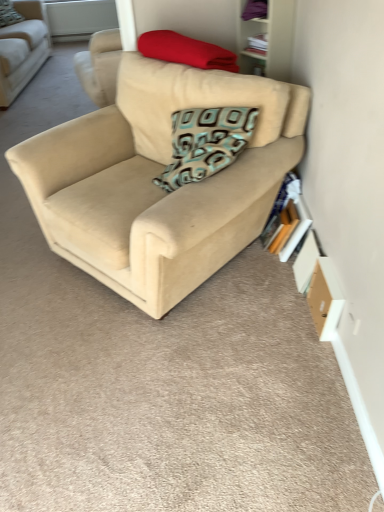
Question: Is teal patterned pillow at upper center, the first pillow from the back, placed right next to matte red blanket at upper center, which is the second pillow from back to front?

Choices:
 (A) yes
 (B) no

Answer: (B)

Question: Could you tell me if teal patterned pillow at upper center, the first pillow from the back, is facing matte red blanket at upper center, which is the second pillow from back to front?

Choices:
 (A) yes
 (B) no

Answer: (A)

Question: Is teal patterned pillow at upper center, the first pillow from the back, shorter than matte red blanket at upper center, marked as the 2th pillow in a top-to-bottom arrangement?

Choices:
 (A) no
 (B) yes

Answer: (A)

Question: Considering the relative positions of teal patterned pillow at upper center, the first pillow when ordered from left to right, and matte red blanket at upper center, which is the 1th pillow in right-to-left order, in the image provided, is teal patterned pillow at upper center, the first pillow when ordered from left to right, to the right of matte red blanket at upper center, which is the 1th pillow in right-to-left order, from the viewer's perspective?

Choices:
 (A) no
 (B) yes

Answer: (A)

Question: Does teal patterned pillow at upper center, positioned as the second pillow in bottom-to-top order, come behind matte red blanket at upper center, the 2th pillow in the left-to-right sequence?

Choices:
 (A) no
 (B) yes

Answer: (B)

Question: Considering the relative positions of teal patterned pillow at upper center, which is counted as the second pillow, starting from the right, and matte red blanket at upper center, which is the second pillow from back to front, in the image provided, is teal patterned pillow at upper center, which is counted as the second pillow, starting from the right, to the left of matte red blanket at upper center, which is the second pillow from back to front, from the viewer's perspective?

Choices:
 (A) no
 (B) yes

Answer: (B)

Question: Is beige fabric couch at center, placed as the second studio couch when sorted from right to left, inside teal patterned pillow at upper center, positioned as the second pillow in bottom-to-top order?

Choices:
 (A) yes
 (B) no

Answer: (B)

Question: Is teal patterned pillow at upper center, which ranks as the 2th pillow in front-to-back order, taller than beige fabric couch at center, which is the 1th studio couch from left to right?

Choices:
 (A) yes
 (B) no

Answer: (B)

Question: Considering the relative sizes of teal patterned pillow at upper center, which is counted as the second pillow, starting from the right, and beige fabric couch at center, which is the 1th studio couch from left to right, in the image provided, is teal patterned pillow at upper center, which is counted as the second pillow, starting from the right, bigger than beige fabric couch at center, which is the 1th studio couch from left to right,?

Choices:
 (A) no
 (B) yes

Answer: (A)

Question: From the image's perspective, is teal patterned pillow at upper center, which ranks as the 2th pillow in front-to-back order, located beneath beige fabric couch at center, which is the 1th studio couch from left to right?

Choices:
 (A) no
 (B) yes

Answer: (A)

Question: Is teal patterned pillow at upper center, positioned as the second pillow in bottom-to-top order, at the right side of beige fabric couch at center, the first studio couch in the back-to-front sequence?

Choices:
 (A) yes
 (B) no

Answer: (B)

Question: Does teal patterned pillow at upper center, the first pillow when ordered from left to right, appear on the left side of beige fabric couch at center, the first studio couch in the back-to-front sequence?

Choices:
 (A) no
 (B) yes

Answer: (B)

Question: Is teal patterned pillow at upper center, which ranks as the 2th pillow in front-to-back order, closer to camera compared to beige fabric couch at center, the first studio couch viewed from the right?

Choices:
 (A) yes
 (B) no

Answer: (B)